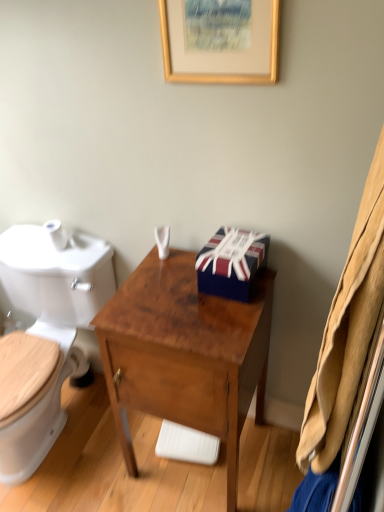
This screenshot has height=512, width=384. Find the location of `vacant region above union jack-patterned gift box at center (from a real-world perspective)`. vacant region above union jack-patterned gift box at center (from a real-world perspective) is located at coordinates (233, 238).